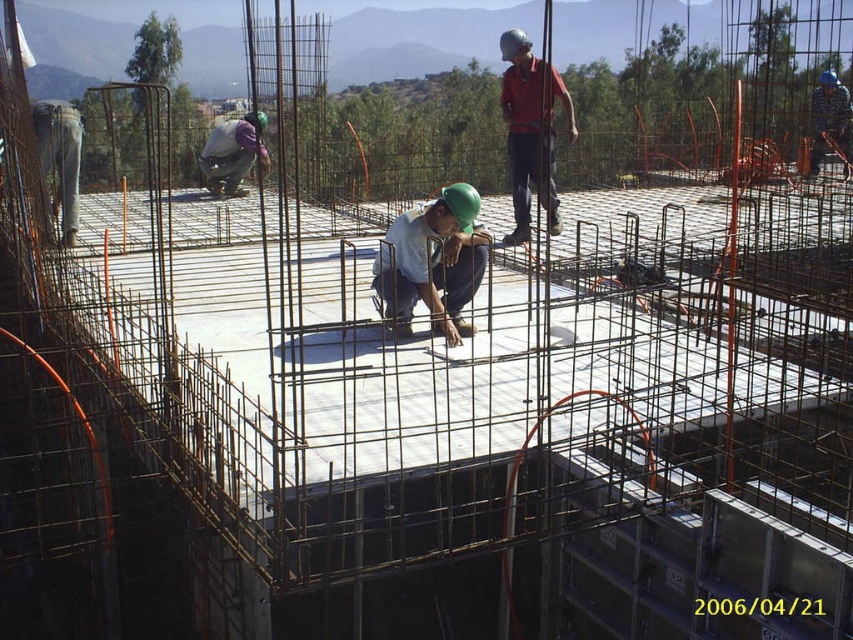
Which is more to the right, green hard hat at center or red matte shirt at upper center?

red matte shirt at upper center

Does green hard hat at center have a lesser height compared to red matte shirt at upper center?

Yes, green hard hat at center is shorter than red matte shirt at upper center.

Does point (463, 236) come in front of point (540, 104)?

No, it is behind (540, 104).

You are a GUI agent. You are given a task and a screenshot of the screen. Output one action in this format:
    pyautogui.click(x=<x>, y=<y>)
    Task: Click on the green hard hat at center
    The image size is (853, 640).
    Given the screenshot: What is the action you would take?
    pyautogui.click(x=432, y=262)

What do you see at coordinates (531, 131) in the screenshot? I see `red matte shirt at upper center` at bounding box center [531, 131].

Where is `red matte shirt at upper center`? The height and width of the screenshot is (640, 853). red matte shirt at upper center is located at coordinates (531, 131).

Is green hard hat at center to the right of gray fabric worker at center from the viewer's perspective?

Correct, you'll find green hard hat at center to the right of gray fabric worker at center.

Measure the distance between point (x=451, y=266) and camera.

The distance of point (x=451, y=266) from camera is 25.14 feet.

Where is `green hard hat at center`? The height and width of the screenshot is (640, 853). green hard hat at center is located at coordinates (432, 262).